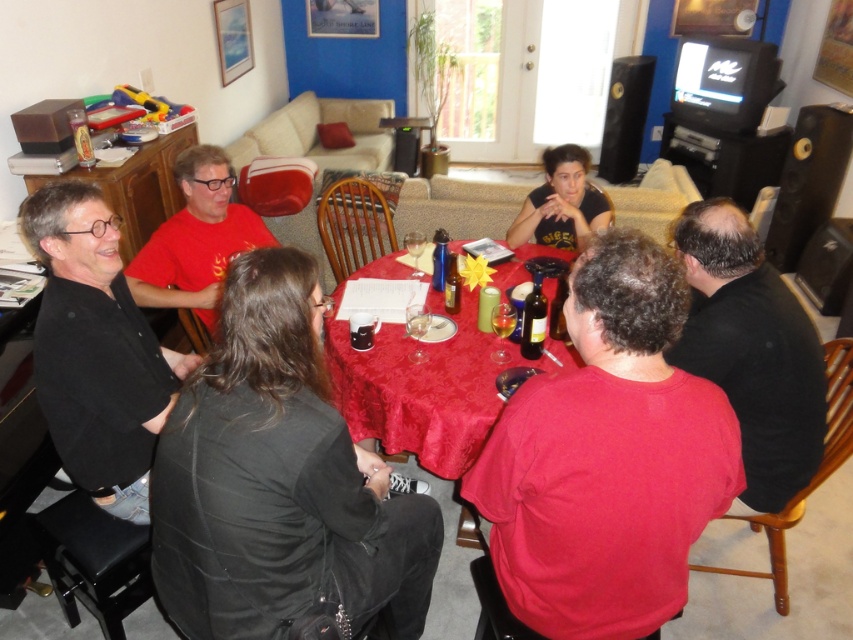
Question: Observing the image, what is the correct spatial positioning of black matte shirt at upper center in reference to translucent glass at table center?

Choices:
 (A) right
 (B) left

Answer: (A)

Question: Which of the following is the closest to the observer?

Choices:
 (A) red matte shirt at center
 (B) matte red shirt at center

Answer: (A)

Question: Can you confirm if red matte shirt at center is positioned below red satin tablecloth at center?

Choices:
 (A) no
 (B) yes

Answer: (B)

Question: Which object appears closest to the camera in this image?

Choices:
 (A) matte black shirt at left
 (B) black matte jacket at lower left
 (C) translucent glass at table center
 (D) red satin tablecloth at center

Answer: (B)

Question: Which point is farther to the camera?

Choices:
 (A) (170, 298)
 (B) (415, 333)
 (C) (561, 180)
 (D) (252, 273)

Answer: (C)

Question: Can you confirm if black matte shirt at right is positioned above translucent glass at table center?

Choices:
 (A) yes
 (B) no

Answer: (B)